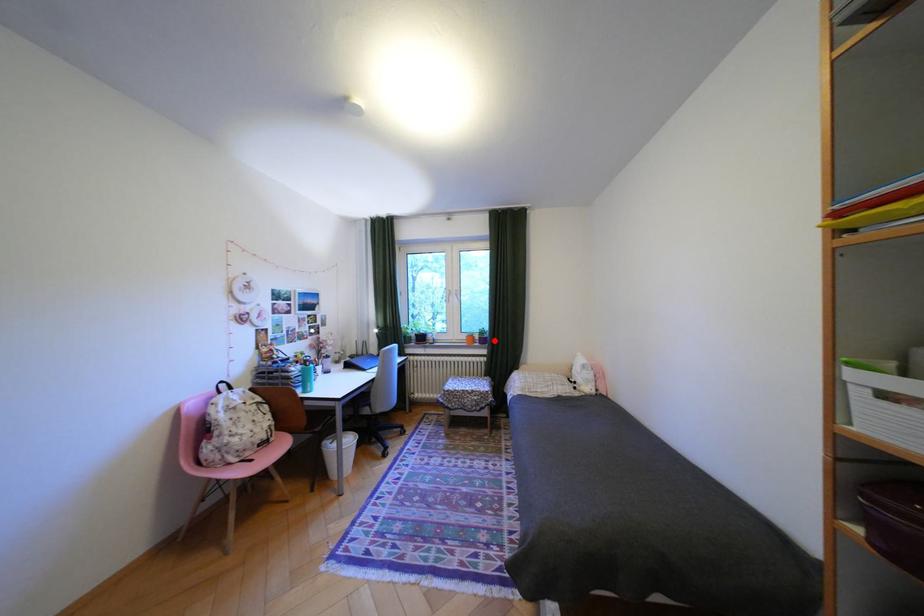
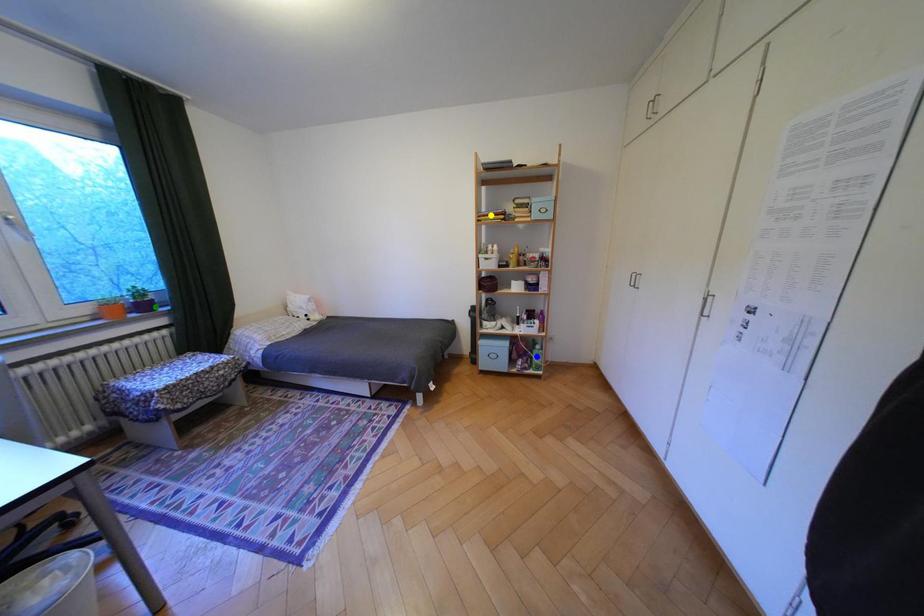
Question: I am providing you with two images of the same scene from different viewpoints. A red point is marked on the first image. You are given multiple points on the second image. Can you choose the point in image 2 that corresponds to the point in image 1?

Choices:
 (A) blue point
 (B) yellow point
 (C) green point

Answer: (C)